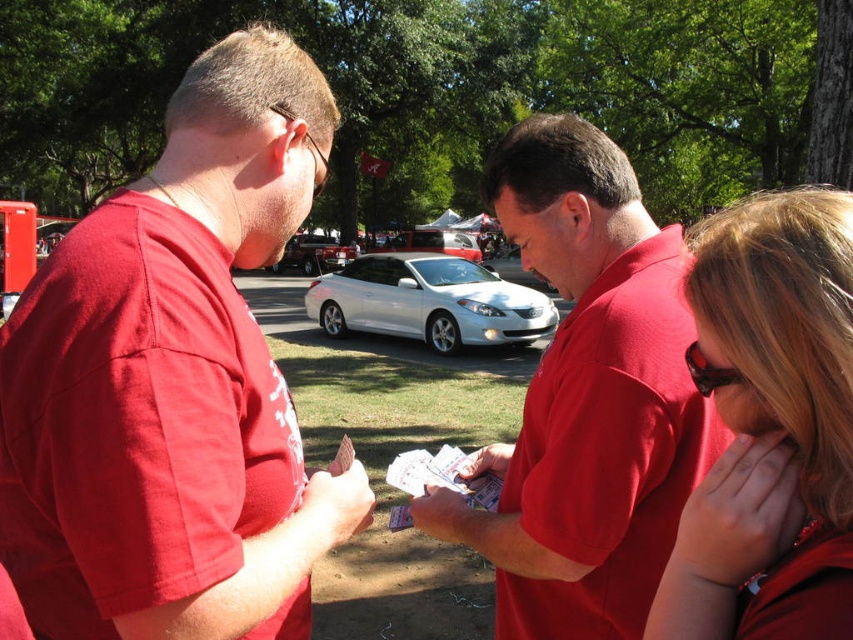
Question: Among these objects, which one is farthest from the camera?

Choices:
 (A) shiny silver sedan at center
 (B) silver metallic car at center
 (C) matte red shirt at center

Answer: (B)

Question: Is matte red shirt at center smaller than white metallic car at center?

Choices:
 (A) yes
 (B) no

Answer: (A)

Question: From the image, what is the correct spatial relationship of shiny silver sedan at center in relation to white metallic car at center?

Choices:
 (A) above
 (B) below

Answer: (B)

Question: Which object is positioned farthest from the matte red shirt at center?

Choices:
 (A) white metallic car at center
 (B) blonde hair at center
 (C) matte red shirt at left

Answer: (A)

Question: Is matte red shirt at left behind shiny silver sedan at center?

Choices:
 (A) yes
 (B) no

Answer: (B)

Question: Which object is farther from the camera taking this photo?

Choices:
 (A) white metallic car at center
 (B) shiny silver sedan at center

Answer: (A)